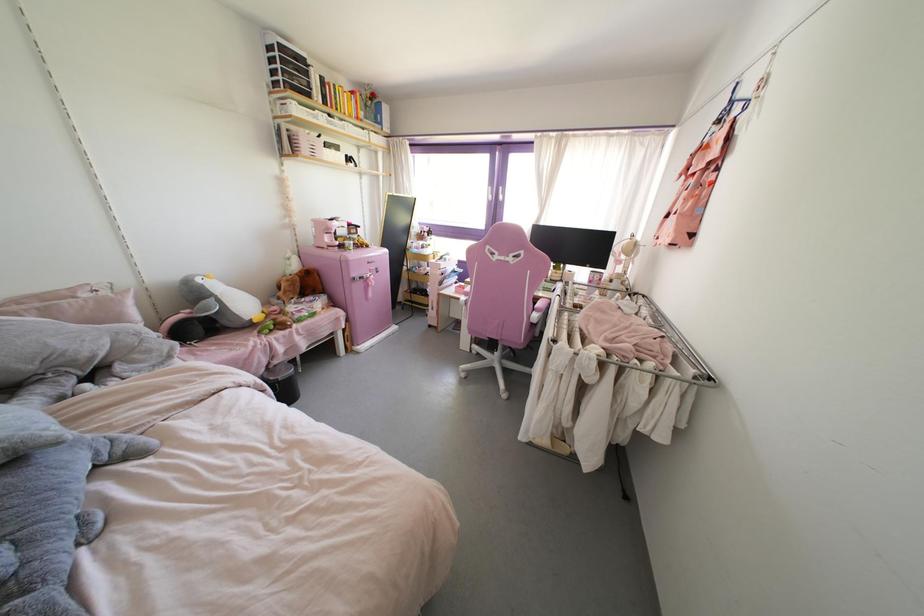
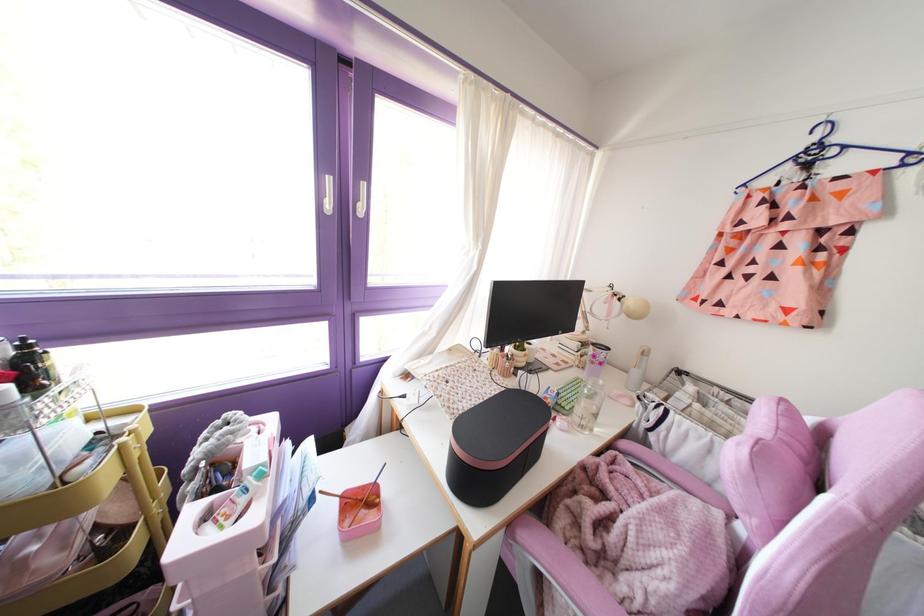
In the second image, find the point that corresponds to the point at 489,197 in the first image.

(329, 205)